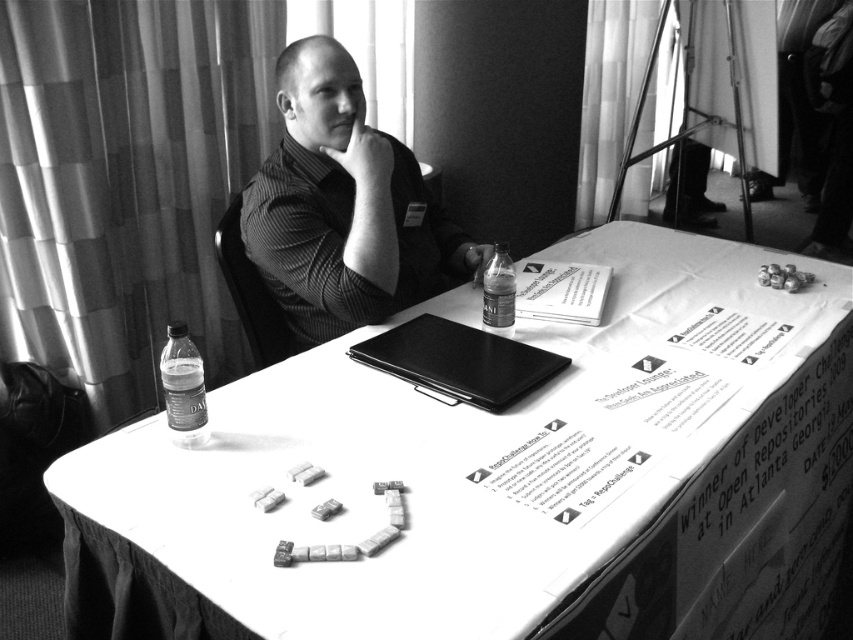
The width and height of the screenshot is (853, 640). Describe the element at coordinates (459, 362) in the screenshot. I see `black matte laptop at center` at that location.

Which of these two, black matte laptop at center or translucent plastic bottle at lower left, stands shorter?

black matte laptop at center

The height and width of the screenshot is (640, 853). Describe the element at coordinates (459, 362) in the screenshot. I see `black matte laptop at center` at that location.

This screenshot has height=640, width=853. I want to click on black matte laptop at center, so click(x=459, y=362).

Is matte black shirt at upper center to the right of black matte laptop at center from the viewer's perspective?

No, matte black shirt at upper center is not to the right of black matte laptop at center.

You are a GUI agent. You are given a task and a screenshot of the screen. Output one action in this format:
    pyautogui.click(x=<x>, y=<y>)
    Task: Click on the matte black shirt at upper center
    
    Given the screenshot: What is the action you would take?
    pyautogui.click(x=343, y=208)

Does white paper at center lie behind matte black shirt at upper center?

That is False.

Between white paper at center and matte black shirt at upper center, which one has more height?

With more height is white paper at center.

What do you see at coordinates (474, 483) in the screenshot?
I see `white paper at center` at bounding box center [474, 483].

Locate an element on the screen. The width and height of the screenshot is (853, 640). white paper at center is located at coordinates (474, 483).